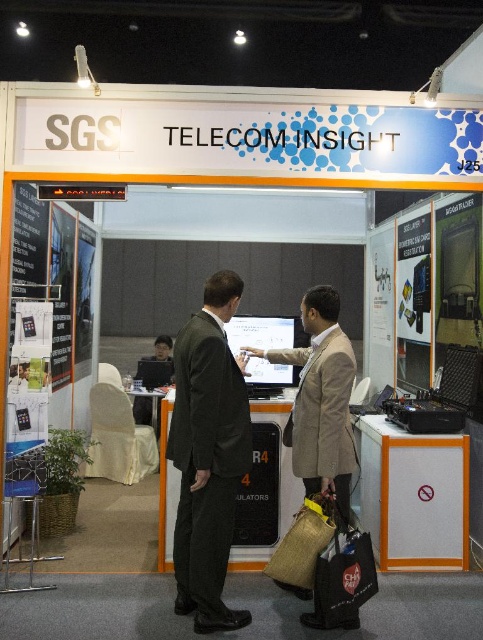
Can you confirm if dark green fabric business suit at center is taller than orange plastic cabinet at lower right?

Yes, dark green fabric business suit at center is taller than orange plastic cabinet at lower right.

Between point (213, 564) and point (367, 476), which one is positioned behind?

The point (367, 476) is more distant.

Where is `dark green fabric business suit at center`? dark green fabric business suit at center is located at coordinates (206, 461).

Consider the image. Between orange plastic cabinet at lower right and beige textured blazer at center, which one is positioned higher?

beige textured blazer at center is higher up.

Is orange plastic cabinet at lower right thinner than beige textured blazer at center?

Correct, orange plastic cabinet at lower right's width is less than beige textured blazer at center's.

Who is more distant from viewer, (415, 472) or (341, 369)?

Positioned behind is point (415, 472).

Locate an element on the screen. Image resolution: width=483 pixels, height=640 pixels. orange plastic cabinet at lower right is located at coordinates (412, 496).

Does dark green fabric business suit at center come behind beige textured blazer at center?

No, dark green fabric business suit at center is closer to the viewer.

Who is more distant from viewer, (204, 513) or (316, 360)?

The point (316, 360) is behind.

Is point (240, 376) closer to camera compared to point (301, 477)?

Yes, it is.

Locate an element on the screen. The image size is (483, 640). dark green fabric business suit at center is located at coordinates (206, 461).